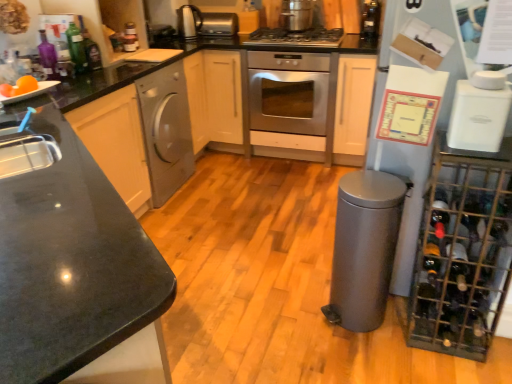
This screenshot has width=512, height=384. I want to click on free location to the left of satin silver trash can at lower right, the third appliance when ordered from left to right, so click(x=298, y=316).